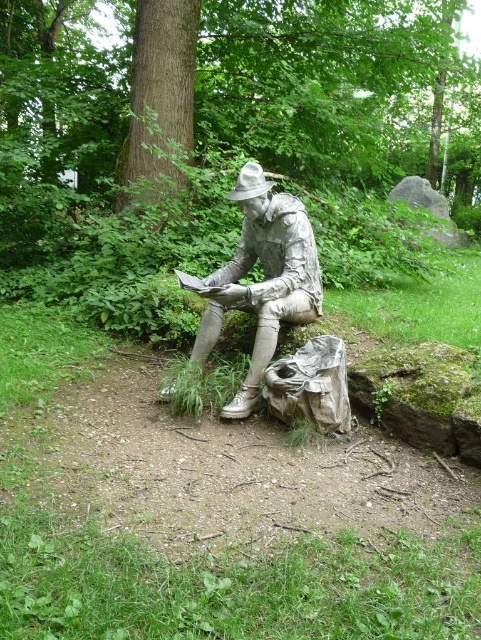
You are standing at point (151, 0) and want to walk to the statue of the man reading a book. Which direction should you move relative to point (304, 240)?

You should move towards point (304, 240) because it is in front of point (151, 0), so moving towards it will lead you closer to the statue.

You are planning to place a small garden ornament between the green textured tree at center and the smooth brown bark at center. Based on their sizes, which object should you position closer to the ornament to ensure it doesn

The green textured tree at center occupies less space than the smooth brown bark at center, so you should position the ornament closer to the green textured tree at center to accommodate the larger size of the smooth brown bark at center.

You are a hiker who wants to take a photo of the green textured tree at center and the brushed metal statue at center. Which object should you focus on first if you want to capture both in the same frame without moving the camera?

The green textured tree at center is not as tall as the brushed metal statue at center, so you should focus on the green textured tree at center first to ensure it is fully in frame before adjusting for the taller statue.